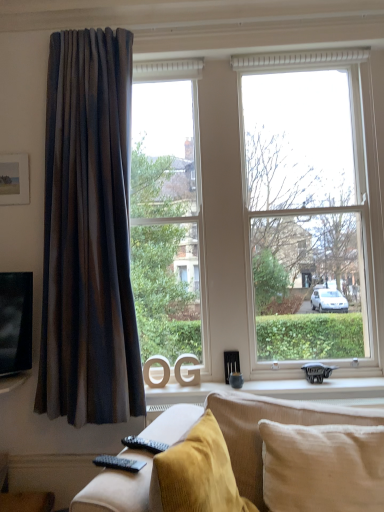
Question: Is point (288, 371) closer or farther from the camera than point (372, 379)?

Choices:
 (A) closer
 (B) farther

Answer: (B)

Question: Visually, is transparent glass window at center positioned to the left or to the right of white matte window sill at center?

Choices:
 (A) left
 (B) right

Answer: (B)

Question: Estimate the real-world distances between objects in this image. Which object is closer to the matte wooden picture frame at upper left?

Choices:
 (A) transparent glass window at center
 (B) white matte window sill at center
 (C) beige cotton pillow at lower right
 (D) matte brown curtain at left
 (E) black plastic remote at lower left

Answer: (D)

Question: Which of these objects is positioned closest to the matte wooden picture frame at upper left?

Choices:
 (A) velvet mustard studio couch at lower center
 (B) black plastic remote at lower left
 (C) matte brown curtain at left
 (D) white matte window sill at center
 (E) transparent glass window at center

Answer: (C)